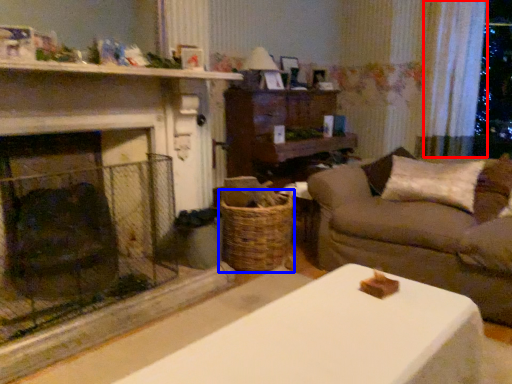
Question: Which of the following is the farthest to the observer, curtain (highlighted by a red box) or basket (highlighted by a blue box)?

Choices:
 (A) curtain
 (B) basket

Answer: (A)